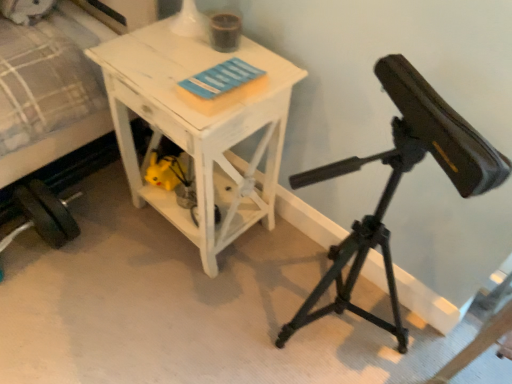
Question: Does white distressed wood table at center have a lesser height compared to white fabric bed at left?

Choices:
 (A) yes
 (B) no

Answer: (A)

Question: From a real-world perspective, is white distressed wood table at center below white fabric bed at left?

Choices:
 (A) yes
 (B) no

Answer: (A)

Question: Is white distressed wood table at center far away from white fabric bed at left?

Choices:
 (A) yes
 (B) no

Answer: (B)

Question: Does white distressed wood table at center come behind white fabric bed at left?

Choices:
 (A) no
 (B) yes

Answer: (B)

Question: Can you confirm if white distressed wood table at center is wider than white fabric bed at left?

Choices:
 (A) no
 (B) yes

Answer: (A)

Question: Does white distressed wood table at center turn towards white fabric bed at left?

Choices:
 (A) no
 (B) yes

Answer: (A)

Question: From the image's perspective, is white fabric bed at left on black matte tripod at right?

Choices:
 (A) yes
 (B) no

Answer: (A)

Question: Does white fabric bed at left have a lesser width compared to black matte tripod at right?

Choices:
 (A) no
 (B) yes

Answer: (A)

Question: Considering the relative positions of white fabric bed at left and black matte tripod at right in the image provided, is white fabric bed at left to the right of black matte tripod at right from the viewer's perspective?

Choices:
 (A) no
 (B) yes

Answer: (A)

Question: Is white fabric bed at left wider than black matte tripod at right?

Choices:
 (A) yes
 (B) no

Answer: (A)

Question: Is white fabric bed at left directly adjacent to black matte tripod at right?

Choices:
 (A) no
 (B) yes

Answer: (A)

Question: Is the depth of white fabric bed at left greater than that of black matte tripod at right?

Choices:
 (A) no
 (B) yes

Answer: (B)

Question: Does black matte tripod at right lie behind white distressed wood table at center?

Choices:
 (A) yes
 (B) no

Answer: (B)